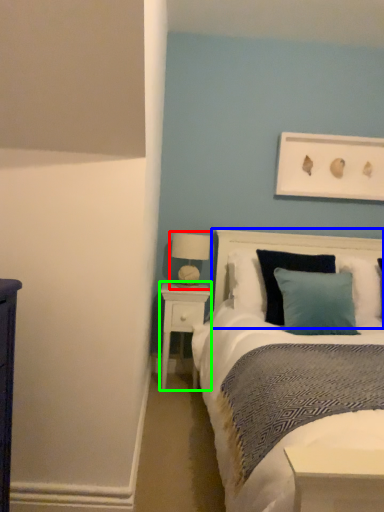
Question: Which object is the farthest from table lamp (highlighted by a red box)? Choose among these: headboard (highlighted by a blue box) or nightstand (highlighted by a green box).

Choices:
 (A) headboard
 (B) nightstand

Answer: (A)